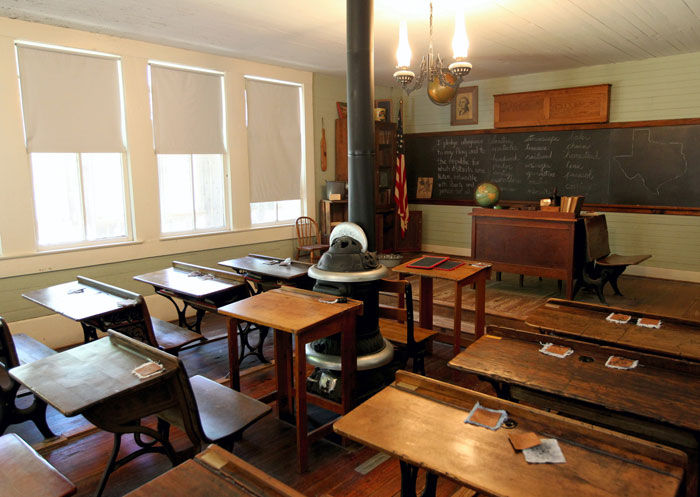
Identify the location of ceiling. This screenshot has width=700, height=497. pyautogui.click(x=549, y=34).